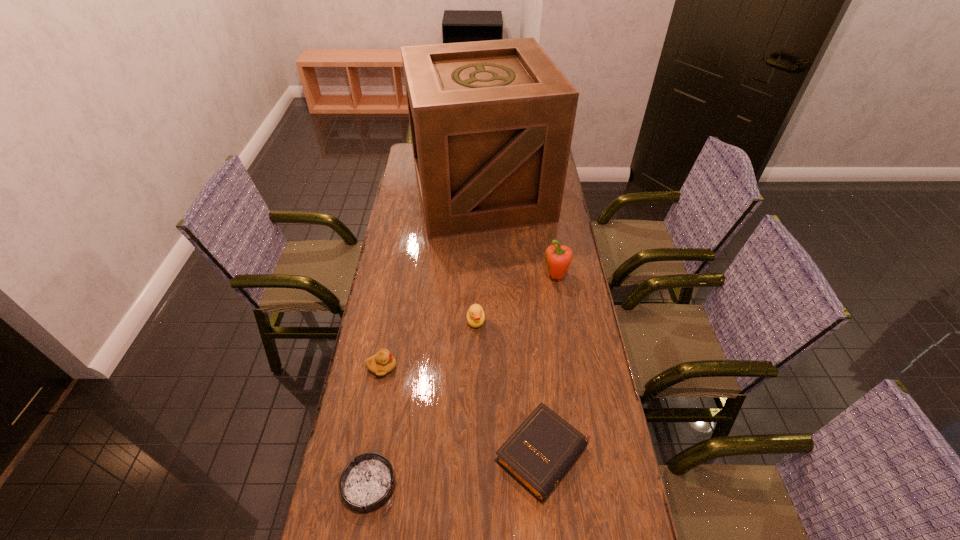
Identify the location of free space located on the front of the tallest object. (482, 279).

The width and height of the screenshot is (960, 540). In order to click on free region located 0.100m on the front of the pepper in this screenshot , I will do `click(562, 309)`.

This screenshot has width=960, height=540. I want to click on free region located on the face of the right duckling, so click(475, 407).

At what (x,y) coordinates should I click in order to perform the action: click on free space located 0.100m at the beak of the nearer duckling. Please return your answer as a coordinate pair (x, y). The image size is (960, 540). Looking at the image, I should click on (429, 367).

Locate an element on the screen. This screenshot has height=540, width=960. blank area located 0.300m on the left of the fifth tallest object is located at coordinates (382, 454).

You are a GUI agent. You are given a task and a screenshot of the screen. Output one action in this format:
    pyautogui.click(x=<x>, y=<y>)
    Task: Click on the free space located on the back of the ashtray
    This screenshot has height=540, width=960.
    Given the screenshot: What is the action you would take?
    pyautogui.click(x=390, y=362)

The height and width of the screenshot is (540, 960). What are the coordinates of `object that is at the far edge` in the screenshot? It's located at (491, 122).

You are a GUI agent. You are given a task and a screenshot of the screen. Output one action in this format:
    pyautogui.click(x=<x>, y=<y>)
    Task: Click on the box situated at the left edge
    
    Given the screenshot: What is the action you would take?
    pyautogui.click(x=491, y=122)

Find the location of a particular element. The height and width of the screenshot is (540, 960). duckling located in the left edge section of the desktop is located at coordinates [383, 362].

I want to click on ashtray present at the left edge, so click(367, 483).